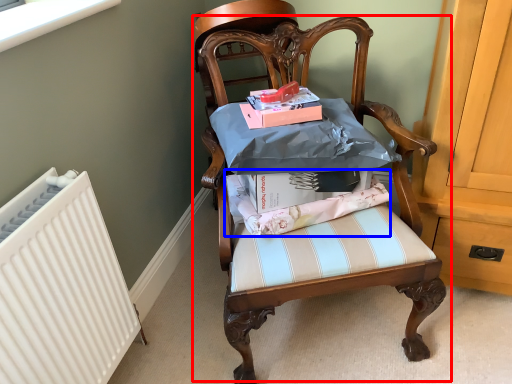
Question: Which of the following is the closest to the observer, chair (highlighted by a red box) or fabric (highlighted by a blue box)?

Choices:
 (A) chair
 (B) fabric

Answer: (A)